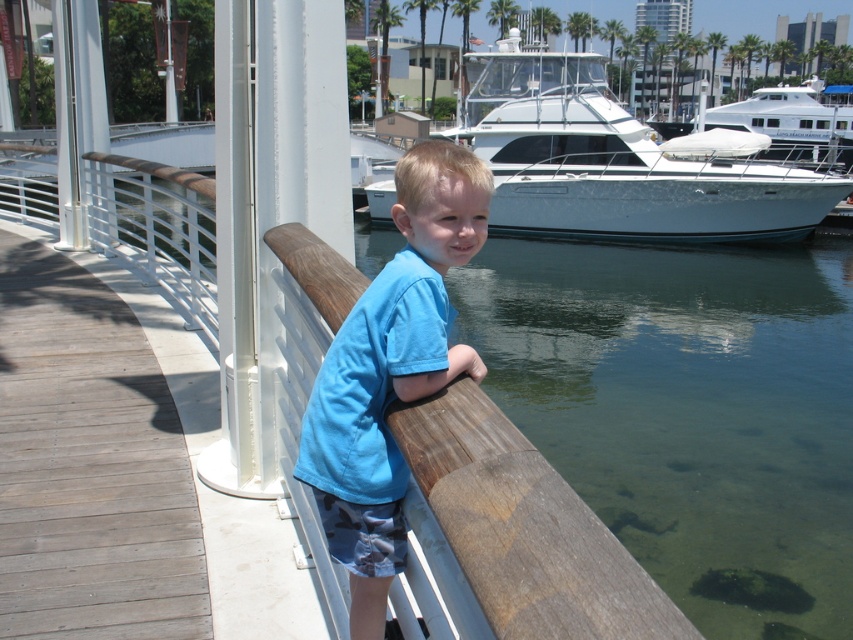
Question: Which point is closer to the camera?

Choices:
 (A) gray wood deck at lower left
 (B) white glossy boat at upper center

Answer: (A)

Question: Is gray wood deck at lower left further to the viewer compared to blue cotton shirt at center?

Choices:
 (A) yes
 (B) no

Answer: (A)

Question: Among these points, which one is farthest from the camera?

Choices:
 (A) (538, 230)
 (B) (428, 202)

Answer: (A)

Question: Does gray wood deck at lower left appear over blue cotton shirt at center?

Choices:
 (A) no
 (B) yes

Answer: (A)

Question: Considering the relative positions of gray wood deck at lower left and blue cotton shirt at center in the image provided, where is gray wood deck at lower left located with respect to blue cotton shirt at center?

Choices:
 (A) below
 (B) above

Answer: (A)

Question: Among these points, which one is nearest to the camera?

Choices:
 (A) (648, 205)
 (B) (44, 448)
 (C) (426, 360)

Answer: (C)